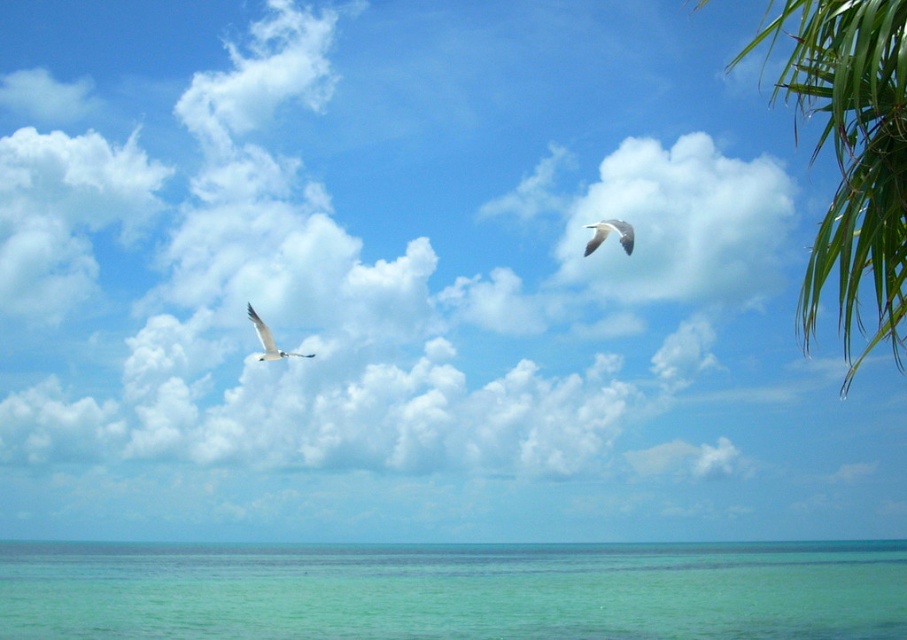
This screenshot has width=907, height=640. What do you see at coordinates (608, 232) in the screenshot? I see `white matte bird at upper right` at bounding box center [608, 232].

Between white matte bird at upper right and white glossy bird at upper left, which one has more height?

Standing taller between the two is white glossy bird at upper left.

Which is in front, point (592, 225) or point (274, 346)?

Point (592, 225)

Find the location of a particular element. white matte bird at upper right is located at coordinates (608, 232).

From the picture: Which of these two, clear water at lower center or white matte bird at upper right, stands shorter?

Standing shorter between the two is white matte bird at upper right.

Does point (369, 560) come farther from viewer compared to point (600, 221)?

That is True.

Where is `clear water at lower center`? clear water at lower center is located at coordinates point(455,592).

Consider the image. Between green leafy palm tree at upper right and white glossy bird at upper left, which one is positioned lower?

white glossy bird at upper left is lower down.

Looking at this image, does green leafy palm tree at upper right have a smaller size compared to white glossy bird at upper left?

No, green leafy palm tree at upper right is not smaller than white glossy bird at upper left.

Locate an element on the screen. This screenshot has width=907, height=640. green leafy palm tree at upper right is located at coordinates (852, 157).